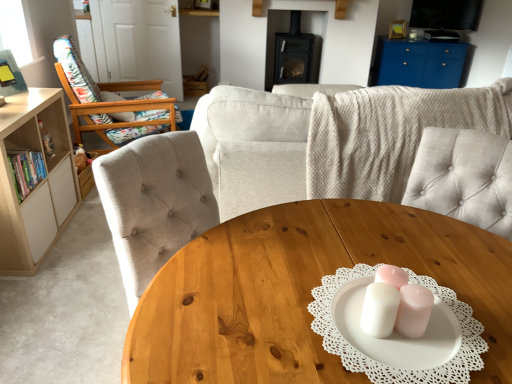
Question: From the image's perspective, is wooden floral-patterned chair at left located beneath wooden coffee table at center?

Choices:
 (A) yes
 (B) no

Answer: (B)

Question: Considering the relative sizes of wooden floral-patterned chair at left and wooden coffee table at center in the image provided, is wooden floral-patterned chair at left shorter than wooden coffee table at center?

Choices:
 (A) no
 (B) yes

Answer: (A)

Question: From the image's perspective, would you say wooden floral-patterned chair at left is positioned over wooden coffee table at center?

Choices:
 (A) no
 (B) yes

Answer: (B)

Question: Is wooden coffee table at center surrounded by wooden floral-patterned chair at left?

Choices:
 (A) yes
 (B) no

Answer: (B)

Question: Considering the relative positions of wooden floral-patterned chair at left and wooden coffee table at center in the image provided, is wooden floral-patterned chair at left behind wooden coffee table at center?

Choices:
 (A) yes
 (B) no

Answer: (A)

Question: From a real-world perspective, does wooden floral-patterned chair at left stand above wooden coffee table at center?

Choices:
 (A) no
 (B) yes

Answer: (B)

Question: Considering the relative sizes of wooden floral-patterned chair at left and blue glossy cabinet at upper right in the image provided, is wooden floral-patterned chair at left taller than blue glossy cabinet at upper right?

Choices:
 (A) no
 (B) yes

Answer: (B)

Question: Is wooden floral-patterned chair at left facing towards blue glossy cabinet at upper right?

Choices:
 (A) yes
 (B) no

Answer: (A)

Question: Is wooden floral-patterned chair at left to the left of blue glossy cabinet at upper right from the viewer's perspective?

Choices:
 (A) yes
 (B) no

Answer: (A)

Question: Is there a large distance between wooden floral-patterned chair at left and blue glossy cabinet at upper right?

Choices:
 (A) no
 (B) yes

Answer: (B)

Question: Is wooden floral-patterned chair at left to the right of blue glossy cabinet at upper right from the viewer's perspective?

Choices:
 (A) no
 (B) yes

Answer: (A)

Question: Is wooden floral-patterned chair at left thinner than blue glossy cabinet at upper right?

Choices:
 (A) yes
 (B) no

Answer: (B)

Question: Is light beige wood bookshelf at left next to beige fabric couch at center?

Choices:
 (A) yes
 (B) no

Answer: (B)